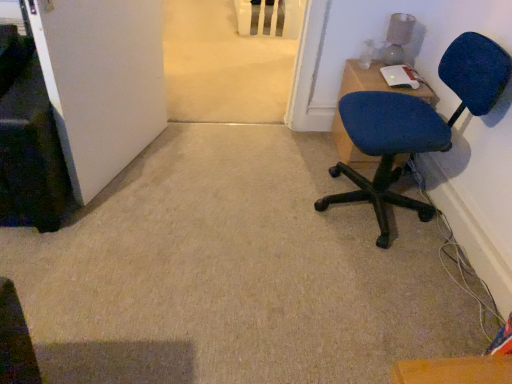
Identify the location of free space to the right of white matte door at lower left. (200, 173).